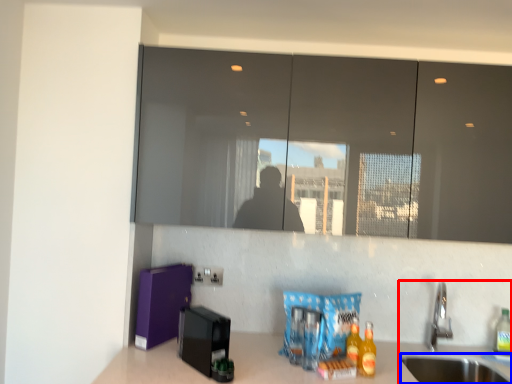
Question: Among these objects, which one is nearest to the camera, sink (highlighted by a red box) or sink (highlighted by a blue box)?

Choices:
 (A) sink
 (B) sink

Answer: (B)